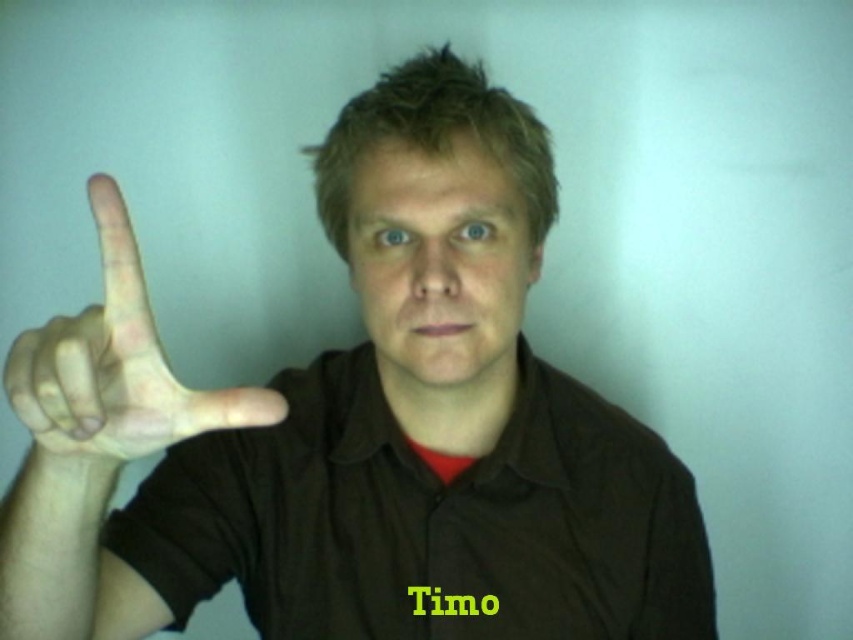
Question: Does matte brown face at center appear under skinny flesh-colored hand at left?

Choices:
 (A) yes
 (B) no

Answer: (B)

Question: Considering the real-world distances, which object is farthest from the brown cotton polo shirt at center?

Choices:
 (A) matte brown face at center
 (B) skinny flesh-colored hand at left

Answer: (B)

Question: Is matte brown face at center smaller than skinny flesh-colored hand at left?

Choices:
 (A) yes
 (B) no

Answer: (B)

Question: Estimate the real-world distances between objects in this image. Which object is farther from the matte brown face at center?

Choices:
 (A) skinny flesh-colored hand at left
 (B) brown cotton polo shirt at center

Answer: (A)

Question: Which of the following is the farthest from the observer?

Choices:
 (A) matte brown face at center
 (B) brown cotton polo shirt at center
 (C) skinny flesh-colored hand at left

Answer: (B)

Question: Does brown cotton polo shirt at center have a greater width compared to matte brown face at center?

Choices:
 (A) yes
 (B) no

Answer: (A)